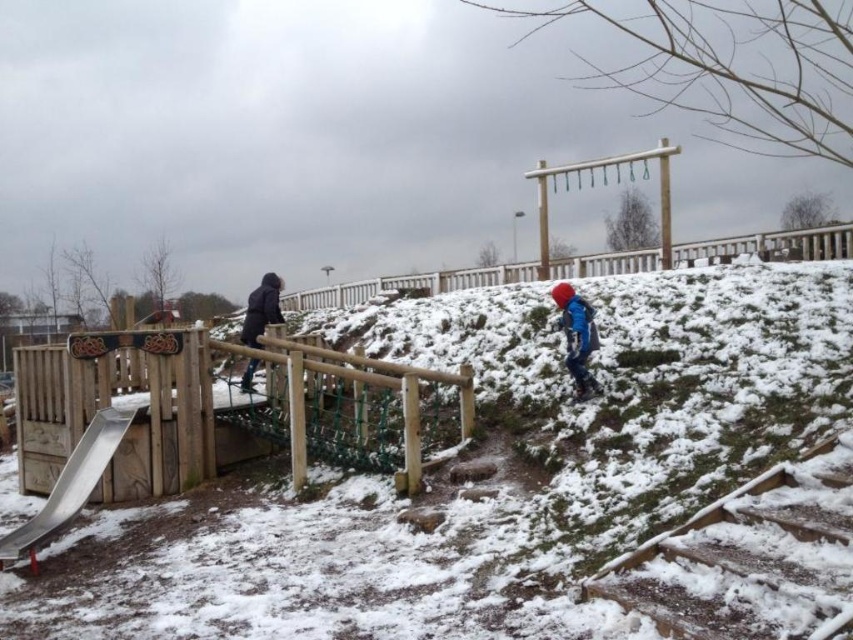
Question: Which point is farther to the camera?

Choices:
 (A) pos(67,508)
 (B) pos(273,291)
 (C) pos(569,369)

Answer: (B)

Question: Which point is farther to the camera?

Choices:
 (A) [51, 515]
 (B) [590, 307]

Answer: (B)

Question: Which of these objects is positioned farthest from the blue fabric jacket at center?

Choices:
 (A) dark blue jacket at left
 (B) metallic smooth slide at lower left

Answer: (B)

Question: Is wooden stairs at lower right positioned before blue fabric jacket at center?

Choices:
 (A) no
 (B) yes

Answer: (B)

Question: In this image, where is metallic smooth slide at lower left located relative to blue fabric jacket at center?

Choices:
 (A) above
 (B) below

Answer: (B)

Question: Observing the image, what is the correct spatial positioning of metallic smooth slide at lower left in reference to dark blue jacket at left?

Choices:
 (A) left
 (B) right

Answer: (B)